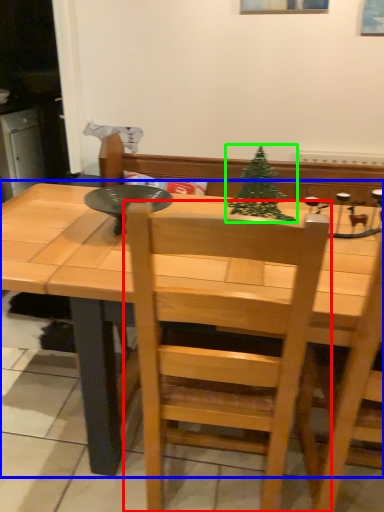
Question: Based on their relative distances, which object is nearer to chair (highlighted by a red box)? Choose from table (highlighted by a blue box) and christmas tree (highlighted by a green box).

Choices:
 (A) table
 (B) christmas tree

Answer: (A)